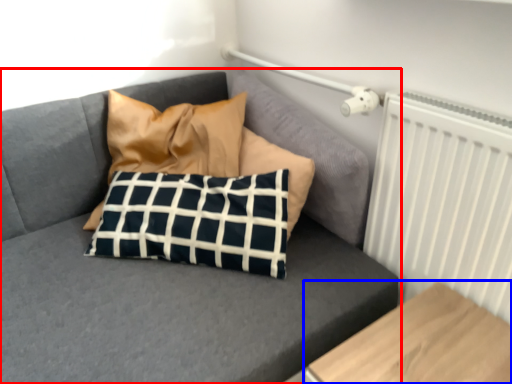
Question: Among these objects, which one is farthest to the camera, studio couch (highlighted by a red box) or furniture (highlighted by a blue box)?

Choices:
 (A) studio couch
 (B) furniture

Answer: (A)